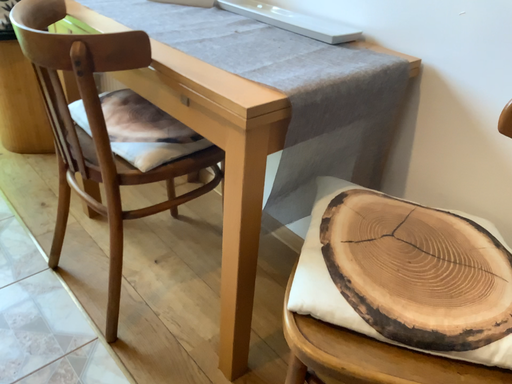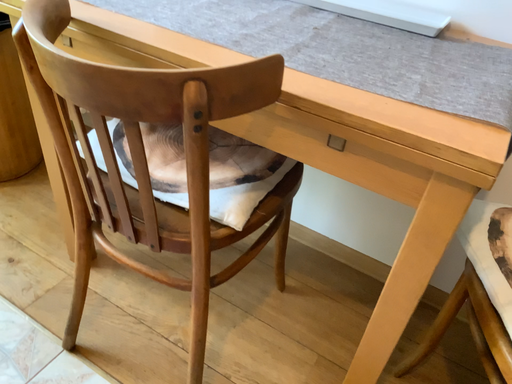
Question: Which way did the camera rotate in the video?

Choices:
 (A) rotated right
 (B) rotated left

Answer: (A)